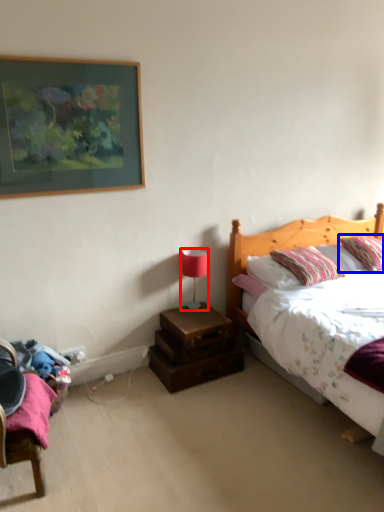
Question: Among these objects, which one is nearest to the camera, table lamp (highlighted by a red box) or pillow (highlighted by a blue box)?

Choices:
 (A) table lamp
 (B) pillow

Answer: (A)